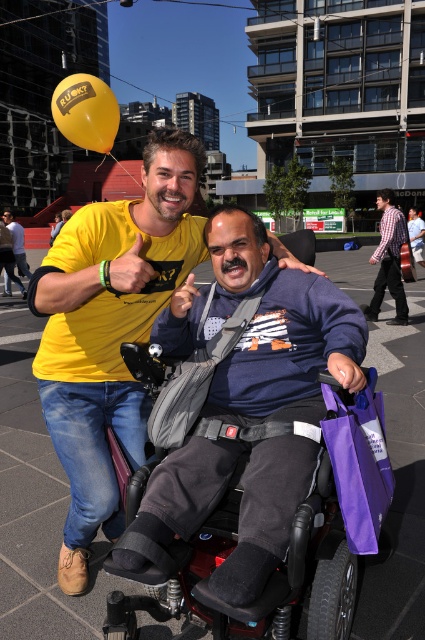
You are a delivery person who needs to carry a package from the purple fabric bag at lower right to a nearby store. The path to the store requires navigating through a narrow doorway that is 2 meters wide. Can the red plastic wheelchair at center pass through the doorway without any adjustments?

The red plastic wheelchair at center has a larger size compared to purple fabric bag at lower right. However, the doorway is 2 meters wide. Since the wheelchair is larger than the bag, but the exact dimensions of the wheelchair are not provided, it is unclear if it can pass through the doorway. More information about the wheelchair dimensions is needed to determine this.

You are a delivery person who needs to transport both the red plastic wheelchair at center and the purple fabric bag at lower right through a narrow doorway that is 1 meter wide. Can both items fit side by side through the doorway?

The red plastic wheelchair at center is wider than the purple fabric bag at lower right. Since the doorway is 1 meter wide, the combined width of both items may exceed the doorway width, so they might not fit side by side.